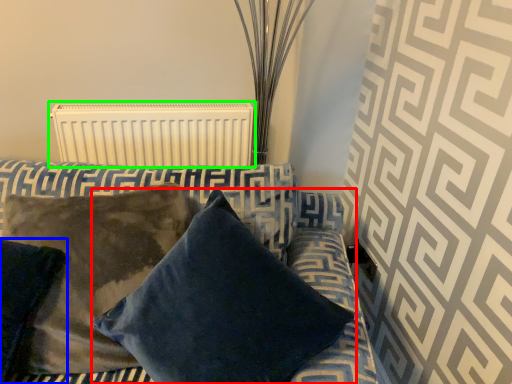
Question: Considering the real-world distances, which object is farthest from pillow (highlighted by a red box)? pillow (highlighted by a blue box) or radiator (highlighted by a green box)?

Choices:
 (A) pillow
 (B) radiator

Answer: (B)